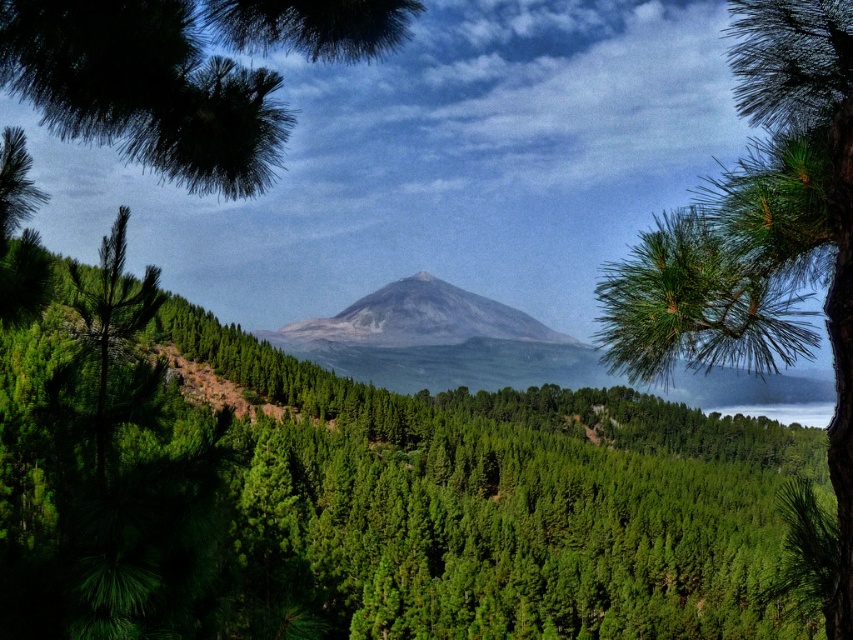
You are an artist sketching this landscape and want to ensure proper layering. Which object should appear in front of the other between the green matte pine branch at upper left and the gray matte mountain at center?

The green matte pine branch at upper left should appear in front of the gray matte mountain at center because it is positioned over it.